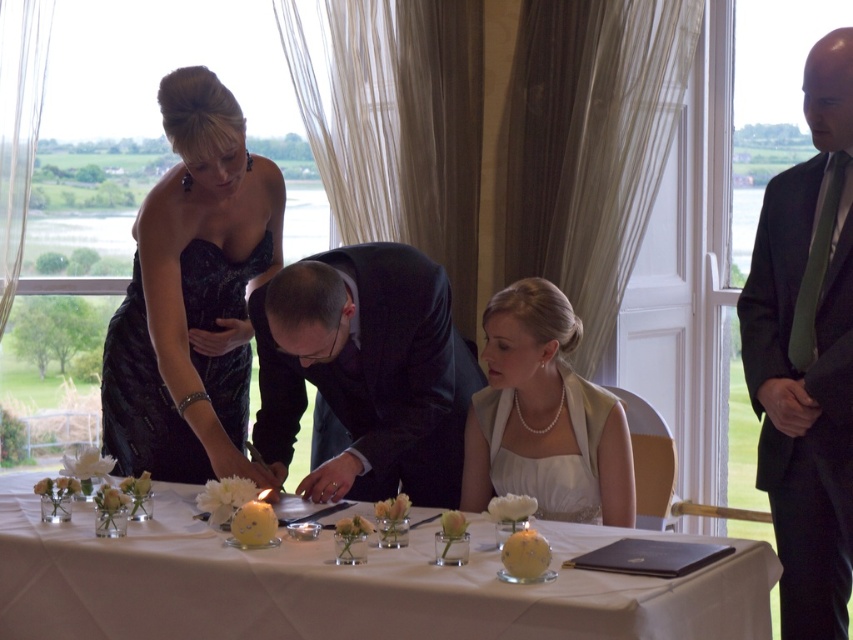
Does white glass table at center appear over dark suit at right?

Incorrect, white glass table at center is not positioned above dark suit at right.

Is white glass table at center further to camera compared to dark suit at right?

No, white glass table at center is closer to the viewer.

Does point (271, 624) lie behind point (805, 515)?

No.

Find the location of `white glass table at center`. white glass table at center is located at coordinates (344, 586).

Does dark suit at right have a larger size compared to dark suit at center?

No, dark suit at right is not bigger than dark suit at center.

Is point (836, 408) closer to camera compared to point (415, 348)?

Yes, it is.

Which is behind, point (817, 291) or point (364, 477)?

Point (364, 477)

Image resolution: width=853 pixels, height=640 pixels. Find the location of `dark suit at right`. dark suit at right is located at coordinates (807, 353).

Is black satin dress at upper left thinner than pearl necklace at center?

No, black satin dress at upper left is not thinner than pearl necklace at center.

In the scene shown: Can you confirm if black satin dress at upper left is positioned above pearl necklace at center?

Yes.

The width and height of the screenshot is (853, 640). What do you see at coordinates (192, 294) in the screenshot?
I see `black satin dress at upper left` at bounding box center [192, 294].

This screenshot has width=853, height=640. I want to click on black satin dress at upper left, so click(192, 294).